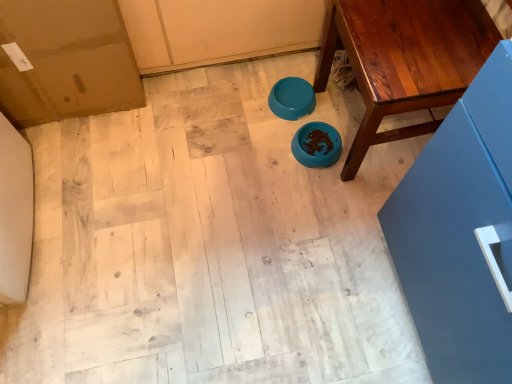
Find the location of a particular element. vacant space in front of blue matte bowl at center, marked as the 1th bowl in a bottom-to-top arrangement is located at coordinates (328, 185).